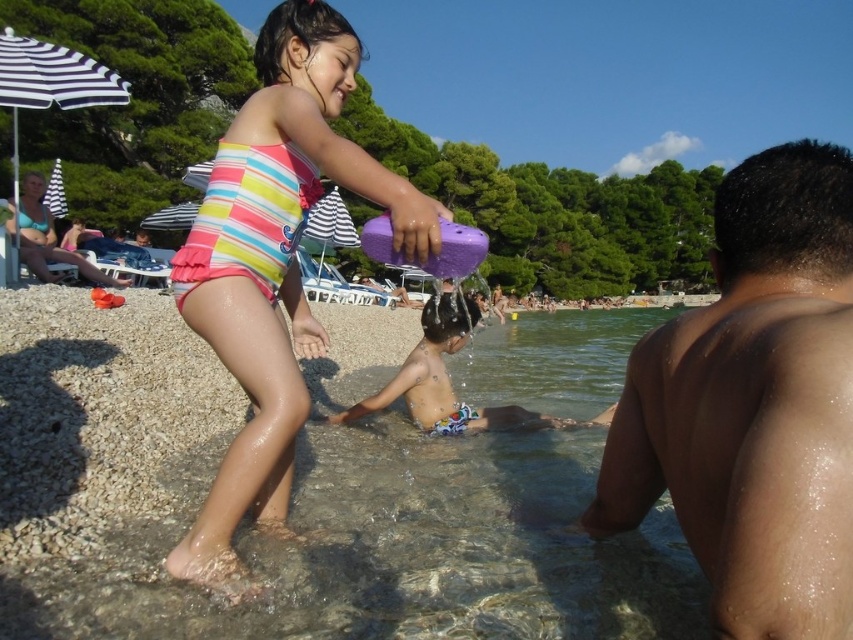
Question: Among these objects, which one is nearest to the camera?

Choices:
 (A) shiny wet skin at lower right
 (B) striped fabric swimsuit at center
 (C) clear water at lower center
 (D) multicolored swim trunks at lower center

Answer: (A)

Question: Can you confirm if shiny wet skin at lower right is wider than multicolored swim trunks at lower center?

Choices:
 (A) no
 (B) yes

Answer: (A)

Question: Among these objects, which one is farthest from the camera?

Choices:
 (A) multicolored swim trunks at lower center
 (B) shiny wet skin at lower right

Answer: (A)

Question: Which of the following is the farthest from the observer?

Choices:
 (A) striped fabric swimsuit at center
 (B) shiny wet skin at lower right
 (C) multicolored swim trunks at lower center
 (D) clear water at lower center

Answer: (C)

Question: Considering the relative positions of clear water at lower center and multicolored swim trunks at lower center in the image provided, where is clear water at lower center located with respect to multicolored swim trunks at lower center?

Choices:
 (A) right
 (B) left

Answer: (B)

Question: Is striped fabric swimsuit at center below multicolored swim trunks at lower center?

Choices:
 (A) yes
 (B) no

Answer: (B)